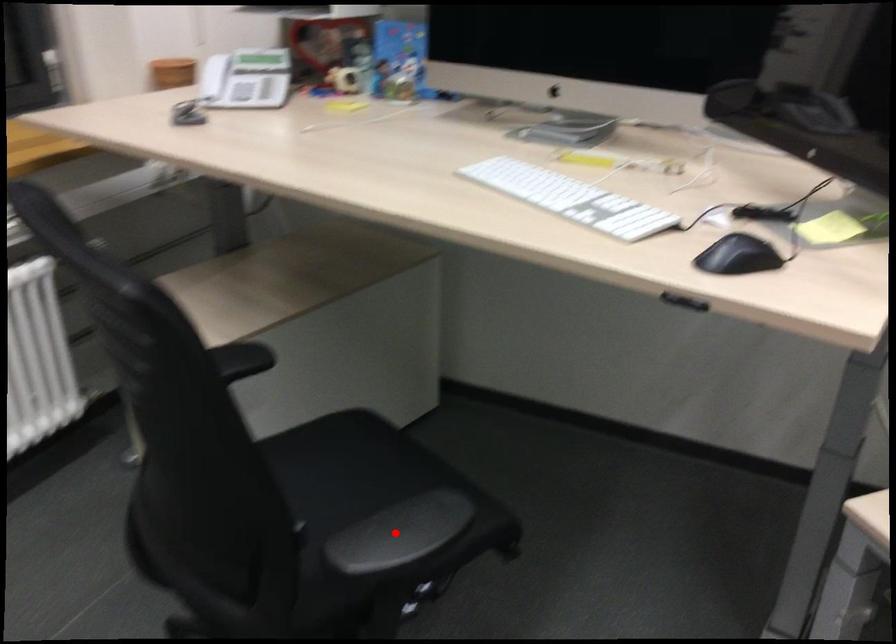
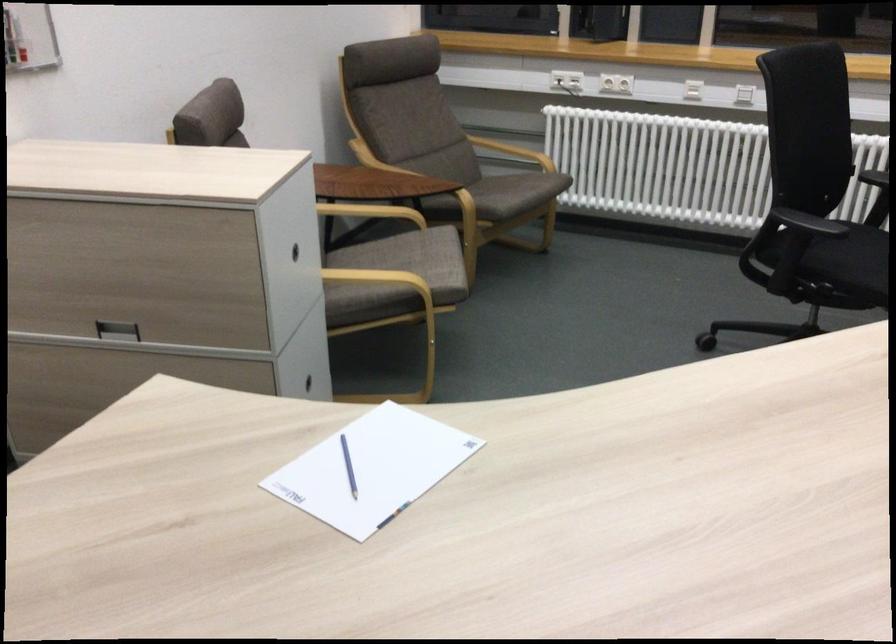
Locate, in the second image, the point that corresponds to the highlighted location in the first image.

(849, 267)